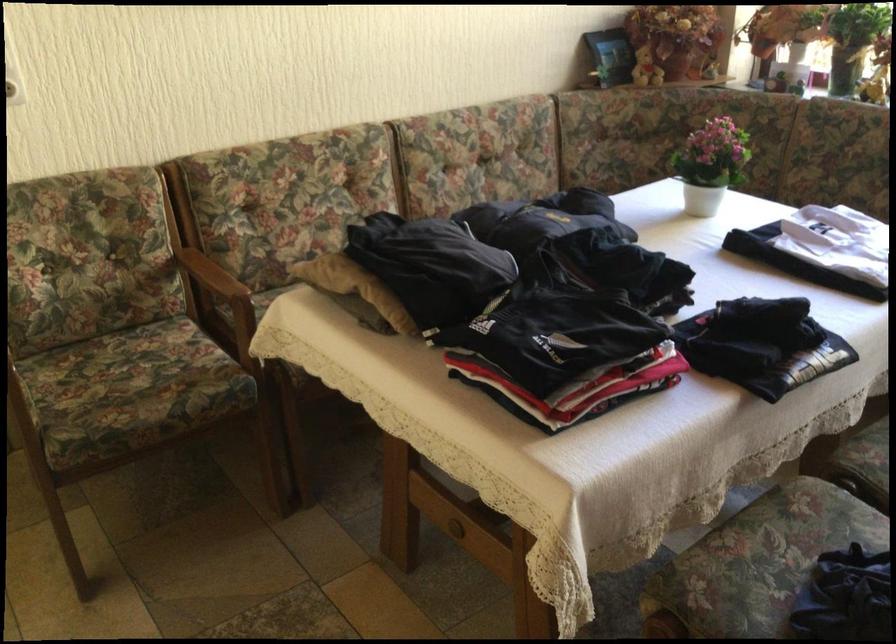
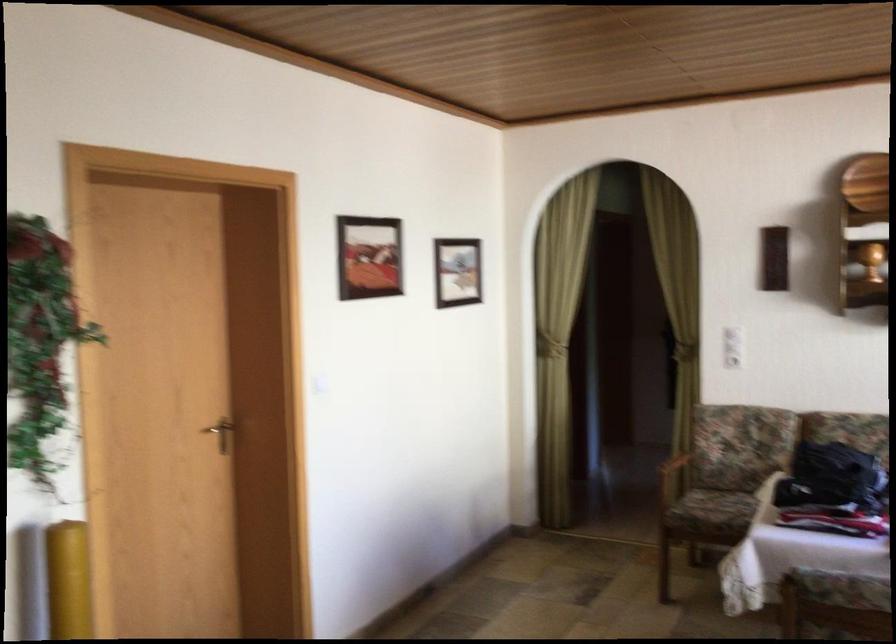
Find the pixel in the second image that matches (536,306) in the first image.

(831, 478)